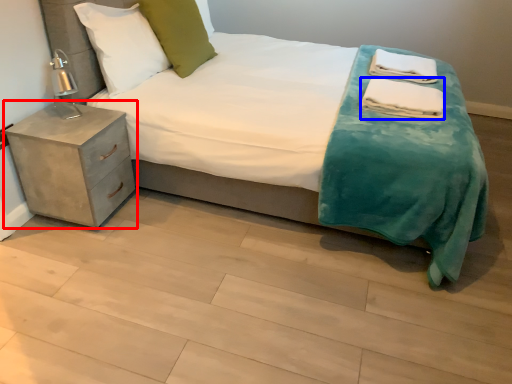
Question: Which object is further to the camera taking this photo, nightstand (highlighted by a red box) or material (highlighted by a blue box)?

Choices:
 (A) nightstand
 (B) material

Answer: (B)